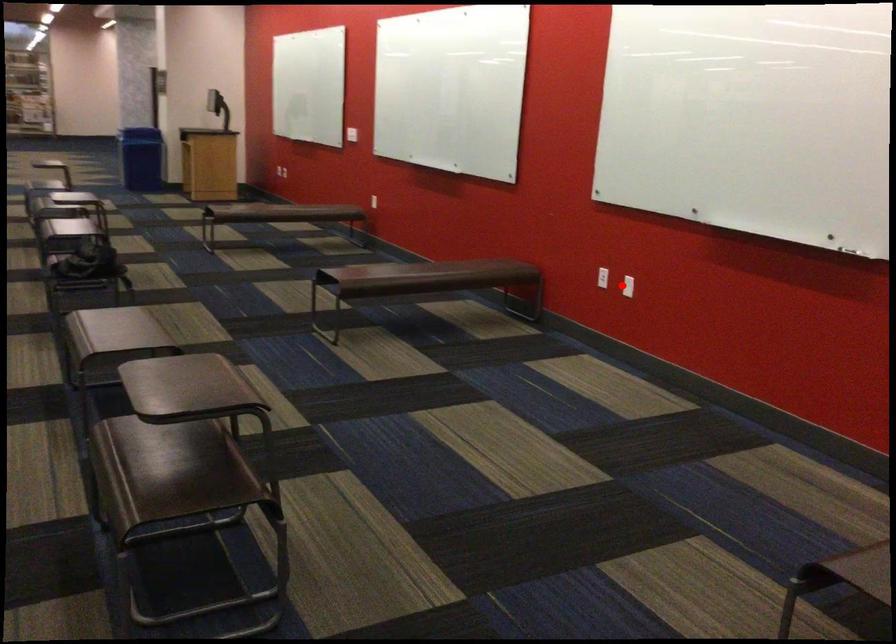
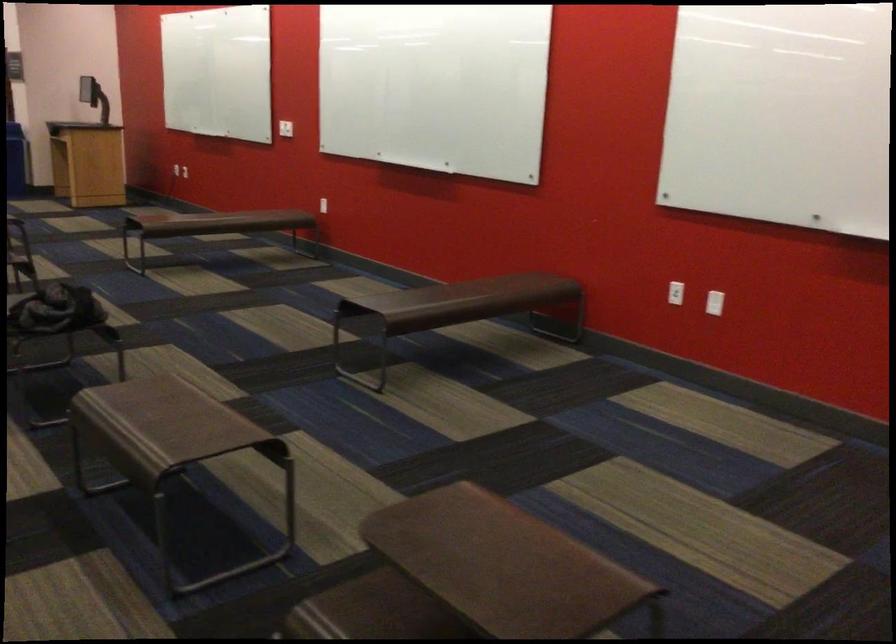
Question: I am providing you with two images of the same scene from different viewpoints. A red point is shown in image1. For the corresponding object point in image2, is it positioned nearer or farther from the camera?

Choices:
 (A) Nearer
 (B) Farther

Answer: (A)